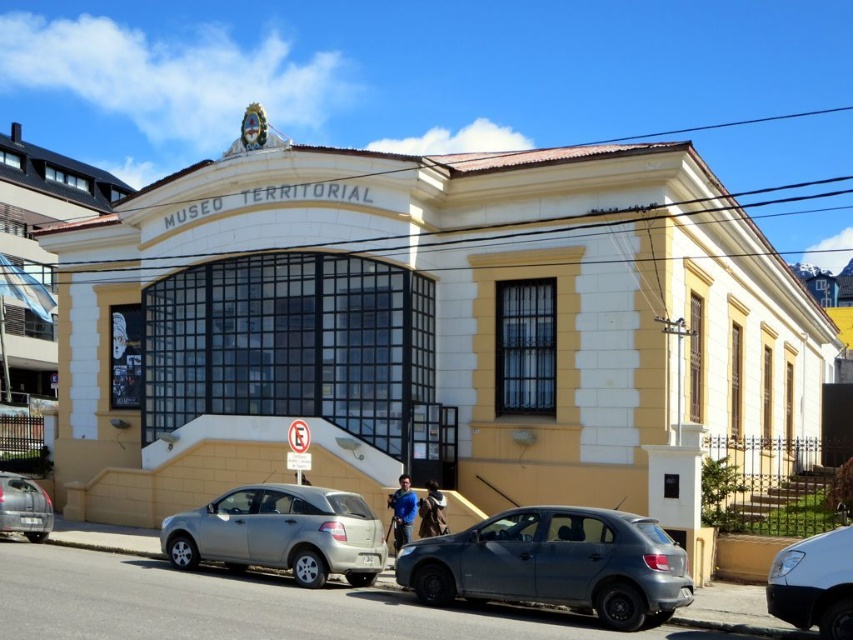
You are standing at the entrance of the MUSEO TERRITORIAL. You see a matte gray hatchback represented by point (555,564). Which direction should you walk to reach the hatchback?

The matte gray hatchback represented by point (555,564) is located at the lower center of the image, so you should walk forward from the entrance to reach it.

You are a visitor arriving at the MUSEO TERRITORIAL. You see a matte gray hatchback at lower center and a silver metallic hatchback at lower left. Which car is taller?

The matte gray hatchback at lower center is much taller than the silver metallic hatchback at lower left.